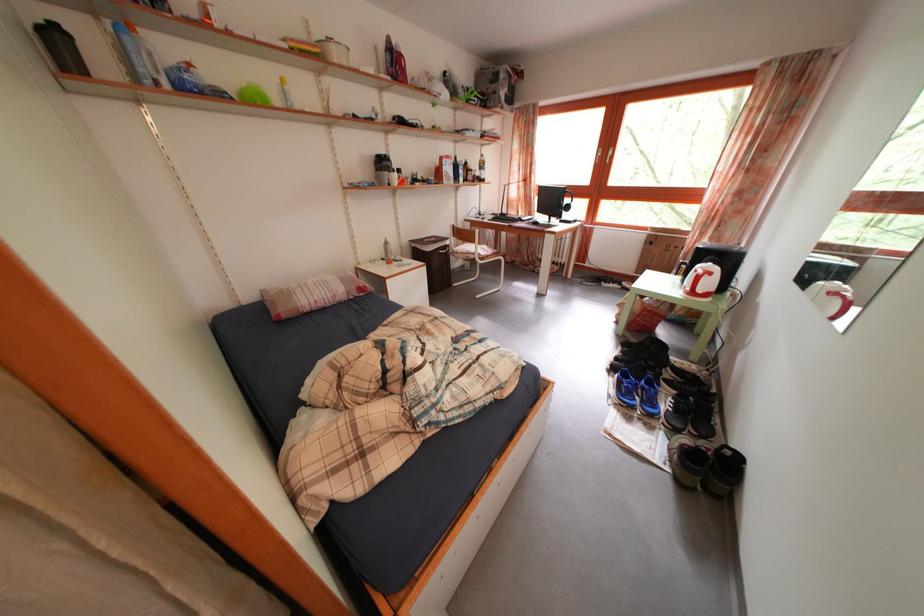
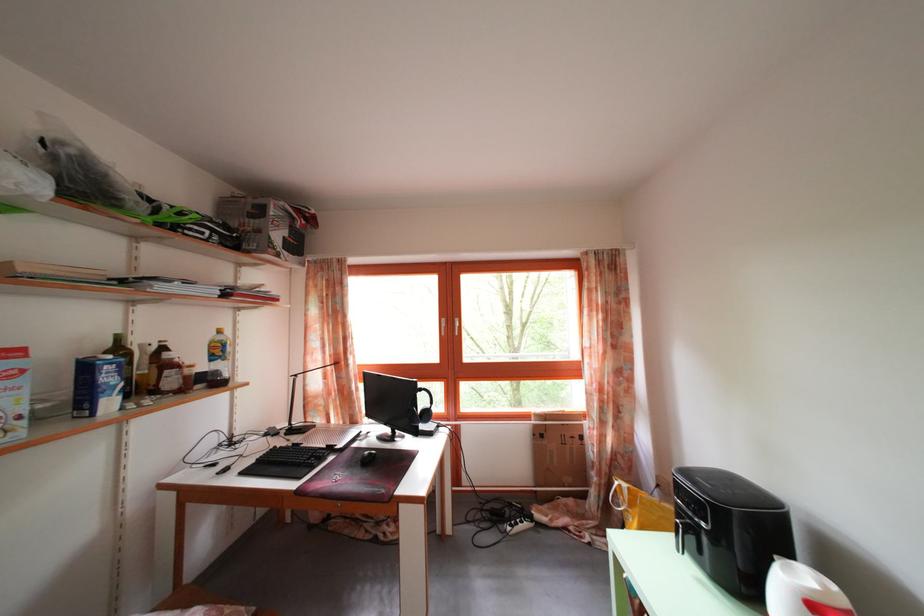
Where in the second image is the point corresponding to the point at 489,172 from the first image?

(225, 359)